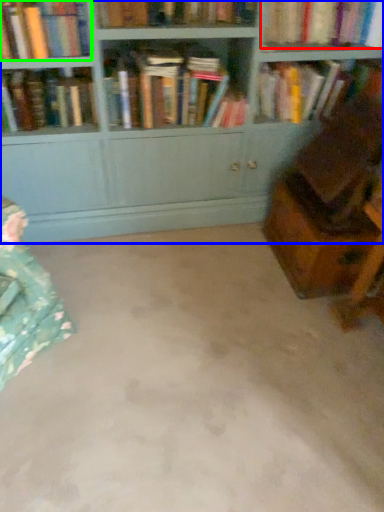
Question: Based on their relative distances, which object is farther from book (highlighted by a red box)? Choose from bookcase (highlighted by a blue box) and book (highlighted by a green box).

Choices:
 (A) bookcase
 (B) book

Answer: (B)